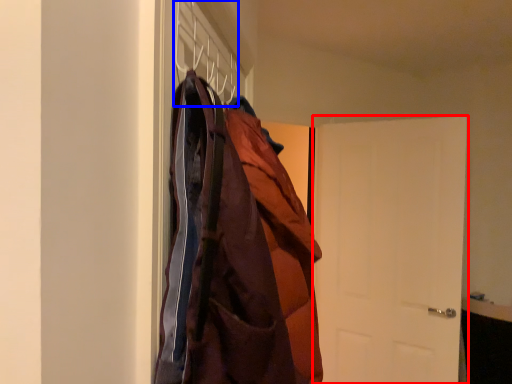
Question: Which object is further to the camera taking this photo, door (highlighted by a red box) or hanger (highlighted by a blue box)?

Choices:
 (A) door
 (B) hanger

Answer: (A)